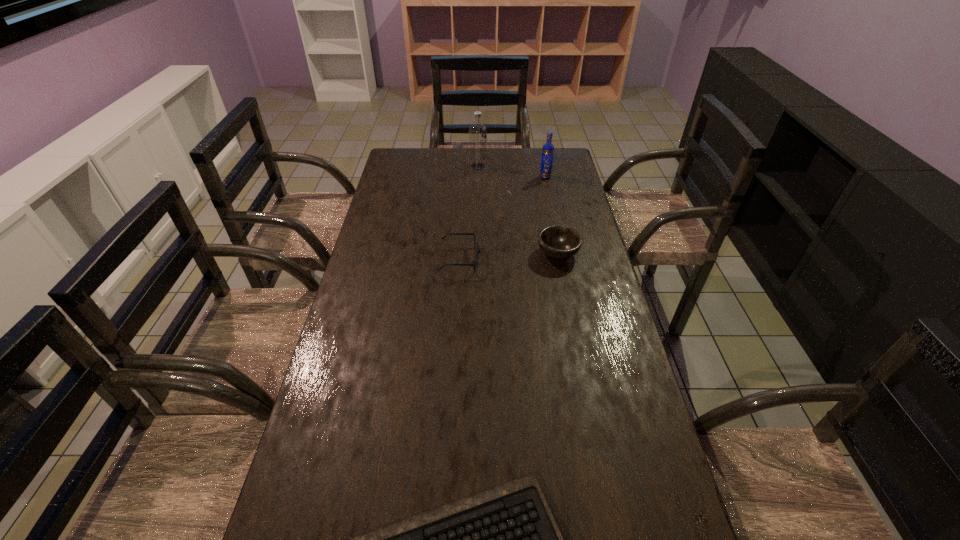
At what (x,y) coordinates should I click in order to perform the action: click on object that is the closest to the bowl. Please return your answer as a coordinate pair (x, y). Looking at the image, I should click on (478, 249).

I want to click on vacant space that satisfies the following two spatial constraints: 1. on the back side of the bowl; 2. on the front label of the farthest object, so click(x=540, y=166).

I want to click on vacant space that satisfies the following two spatial constraints: 1. on the front label of the left vodka; 2. on the right side of the second tallest object, so click(x=478, y=177).